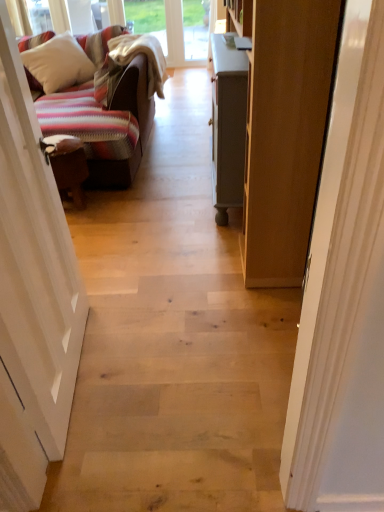
Question: From the image's perspective, is white soft pillow at upper left below white wood door at left, the 2th door viewed from the right?

Choices:
 (A) no
 (B) yes

Answer: (A)

Question: Can you confirm if white soft pillow at upper left is thinner than white wood door at left, the 2th door viewed from the right?

Choices:
 (A) yes
 (B) no

Answer: (B)

Question: Is white soft pillow at upper left surrounding white wood door at left, the 2th door viewed from the right?

Choices:
 (A) yes
 (B) no

Answer: (B)

Question: Is white soft pillow at upper left positioned with its back to white wood door at left, the 1th door viewed from the left?

Choices:
 (A) no
 (B) yes

Answer: (A)

Question: Considering the relative positions of white soft pillow at upper left and white wood door at left, the 1th door viewed from the left, in the image provided, is white soft pillow at upper left in front of white wood door at left, the 1th door viewed from the left,?

Choices:
 (A) no
 (B) yes

Answer: (A)

Question: From the image's perspective, is white soft pillow at upper left located above or below white wood door at left, the 1th door viewed from the left?

Choices:
 (A) above
 (B) below

Answer: (A)

Question: Considering their positions, is white soft pillow at upper left located in front of or behind white wood door at left, the 2th door viewed from the right?

Choices:
 (A) front
 (B) behind

Answer: (B)

Question: Considering the positions of white soft pillow at upper left and white wood door at left, the 1th door viewed from the left, in the image, is white soft pillow at upper left taller or shorter than white wood door at left, the 1th door viewed from the left,?

Choices:
 (A) tall
 (B) short

Answer: (B)

Question: Considering the positions of point (54, 40) and point (34, 318), is point (54, 40) closer or farther from the camera than point (34, 318)?

Choices:
 (A) farther
 (B) closer

Answer: (A)

Question: Is white painted wood door at right, arranged as the 2th door when viewed from the left, spatially inside white wood door at left, the 1th door viewed from the left, or outside of it?

Choices:
 (A) inside
 (B) outside

Answer: (B)

Question: In the image, is white painted wood door at right, the first door from the right, on the left side or the right side of white wood door at left, the 1th door viewed from the left?

Choices:
 (A) left
 (B) right

Answer: (B)

Question: Looking at their shapes, would you say white painted wood door at right, arranged as the 2th door when viewed from the left, is wider or thinner than white wood door at left, the 1th door viewed from the left?

Choices:
 (A) wide
 (B) thin

Answer: (B)

Question: Is point (377, 347) closer or farther from the camera than point (71, 345)?

Choices:
 (A) farther
 (B) closer

Answer: (B)

Question: Is white wood door at left, the 1th door viewed from the left, wider or thinner than white painted wood door at right, the first door from the right?

Choices:
 (A) thin
 (B) wide

Answer: (B)

Question: In terms of height, does white wood door at left, the 2th door viewed from the right, look taller or shorter compared to white painted wood door at right, arranged as the 2th door when viewed from the left?

Choices:
 (A) tall
 (B) short

Answer: (A)